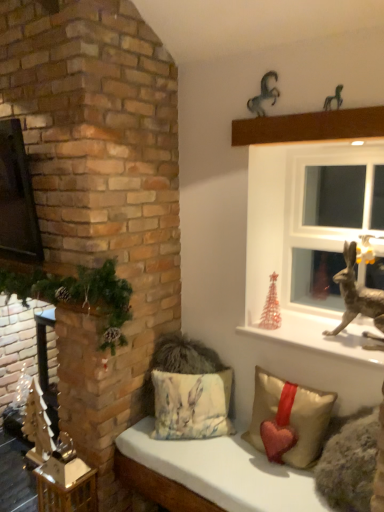
Where is `vacant area on top of white plastic window at upper right (from a real-world perspective)`? This screenshot has width=384, height=512. vacant area on top of white plastic window at upper right (from a real-world perspective) is located at coordinates (331, 148).